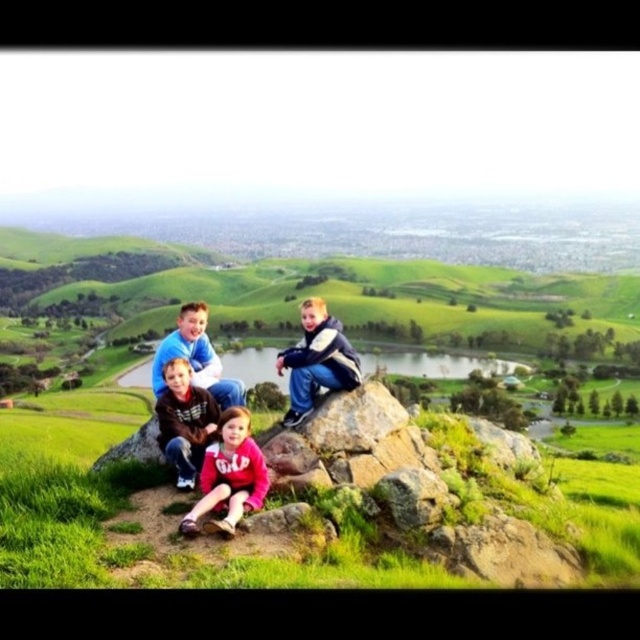
You are trying to locate the matte pink hoodie at lower center and the smooth gray rock at center in the image. Based on the scene description, which object is positioned to the right side of the other?

The smooth gray rock at center is positioned to the right of the matte pink hoodie at lower center because the matte pink hoodie at lower center is to the left of smooth gray rock at center.

You are a photographer trying to capture a photo of the matte pink hoodie at lower center and the smooth gray rock at center. You need to ensure that both objects are in focus. Given that your camera can only focus on objects within a 5 feet range of each other, will both objects be in focus?

The distance between the matte pink hoodie at lower center and the smooth gray rock at center is 8.83 feet, which exceeds the 5 feet focus range. Therefore, both objects cannot be in focus simultaneously.